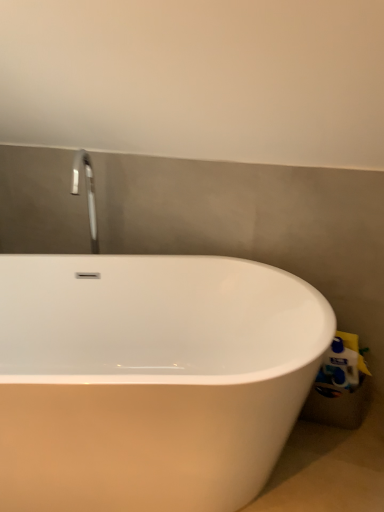
Question: In terms of width, does white plastic toilet paper at lower right look wider or thinner when compared to white glossy bathtub at center?

Choices:
 (A) wide
 (B) thin

Answer: (B)

Question: Relative to white glossy bathtub at center, is white plastic toilet paper at lower right in front or behind?

Choices:
 (A) front
 (B) behind

Answer: (B)

Question: Is point click(339, 366) closer or farther from the camera than point click(71, 160)?

Choices:
 (A) farther
 (B) closer

Answer: (B)

Question: Is white glossy bathtub at center in front of or behind white plastic toilet paper at lower right in the image?

Choices:
 (A) behind
 (B) front

Answer: (B)

Question: Looking at their shapes, would you say white glossy bathtub at center is wider or thinner than white plastic toilet paper at lower right?

Choices:
 (A) thin
 (B) wide

Answer: (B)

Question: From the image's perspective, is white glossy bathtub at center above or below white plastic toilet paper at lower right?

Choices:
 (A) above
 (B) below

Answer: (B)

Question: Do you think white glossy bathtub at center is within white plastic toilet paper at lower right, or outside of it?

Choices:
 (A) inside
 (B) outside

Answer: (B)